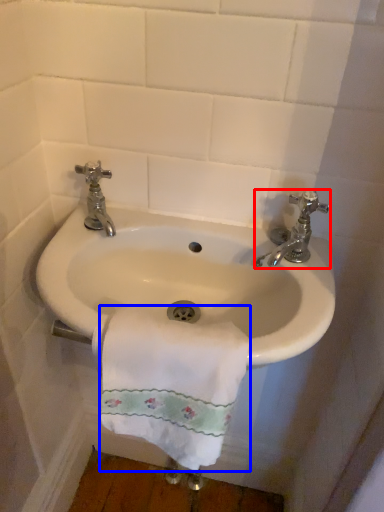
Question: Which point is closer to the camera, tap (highlighted by a red box) or towel/napkin (highlighted by a blue box)?

Choices:
 (A) tap
 (B) towel/napkin

Answer: (B)